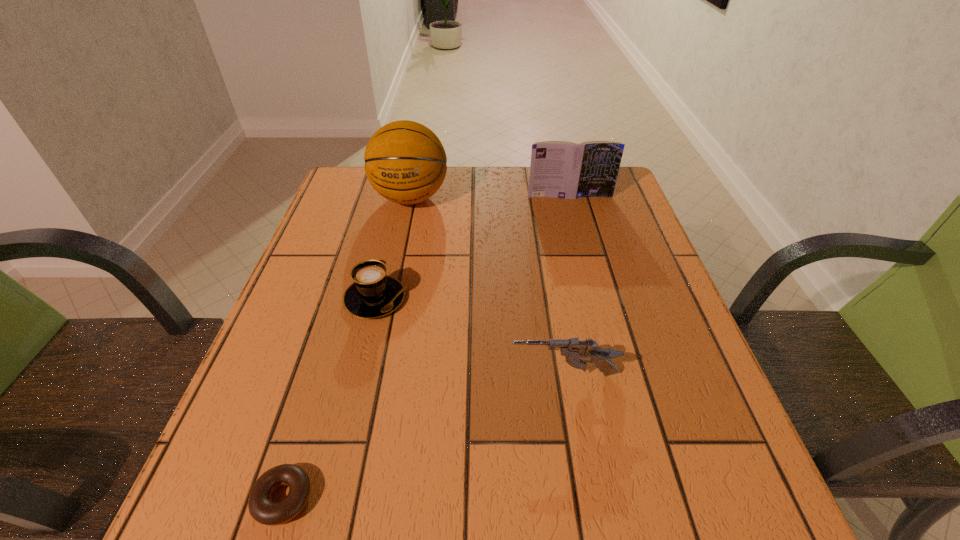
The width and height of the screenshot is (960, 540). I want to click on free location at the far left corner of the desktop, so (372, 208).

Where is `vacant space at the near right corner`? vacant space at the near right corner is located at coordinates (721, 525).

This screenshot has height=540, width=960. I want to click on free space between the basketball and the second tallest object, so click(490, 197).

What are the coordinates of `free space between the tallest object and the doughnut` in the screenshot? It's located at (348, 348).

I want to click on free space between the doughnut and the second shortest object, so click(x=329, y=399).

The width and height of the screenshot is (960, 540). I want to click on free spot between the basketball and the third tallest object, so click(x=487, y=286).

Locate an element on the screen. free space between the fourth shortest object and the cappuccino is located at coordinates (472, 247).

At what (x,y) coordinates should I click in order to perform the action: click on vacant space in between the gun and the book. Please return your answer as a coordinate pair (x, y). Looking at the image, I should click on (566, 286).

What are the coordinates of `free point between the gun and the book` in the screenshot? It's located at (566, 286).

You are a GUI agent. You are given a task and a screenshot of the screen. Output one action in this format:
    pyautogui.click(x=<x>, y=<y>)
    Task: Click on the vacant area that lies between the doughnut and the gun
    The width and height of the screenshot is (960, 540).
    Given the screenshot: What is the action you would take?
    pyautogui.click(x=423, y=436)